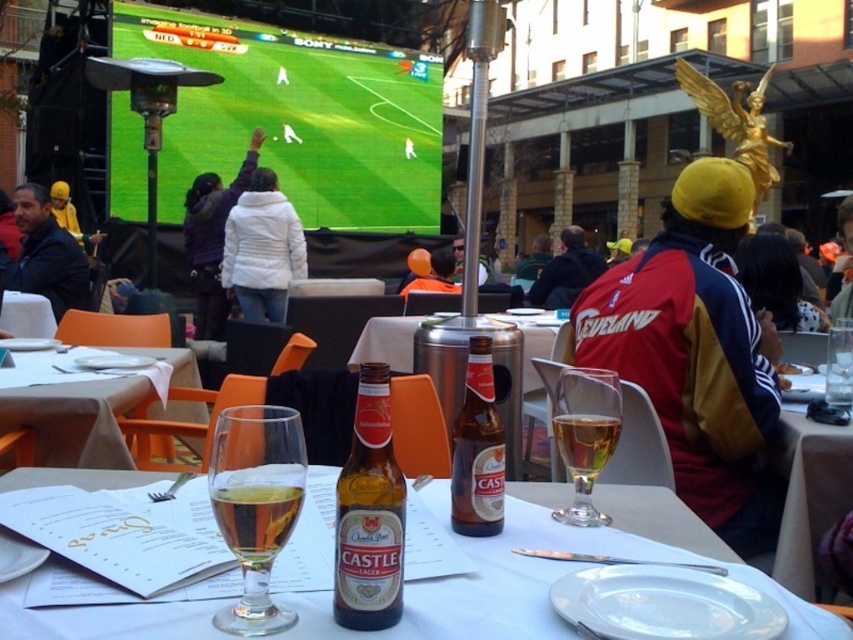
Question: Is white fabric table at lower left positioned behind clear glass beer at center?

Choices:
 (A) yes
 (B) no

Answer: (A)

Question: Considering the real-world distances, which object is farthest from the red and blue jacket at center?

Choices:
 (A) translucent glass at table center
 (B) dark blue jacket at center
 (C) orange fabric at center

Answer: (B)

Question: In this image, where is clear glass wine glass at center located relative to white matte jacket at upper center?

Choices:
 (A) left
 (B) right

Answer: (B)

Question: Which object is closer to the camera taking this photo?

Choices:
 (A) white paper napkin at upper left
 (B) amber glass castle lager at center
 (C) white puffy jacket at upper center
 (D) clear glass wine glass at center

Answer: (D)

Question: Which of the following is the farthest from the observer?

Choices:
 (A) (741, 385)
 (B) (373, 353)
 (C) (576, 429)

Answer: (B)

Question: Is white puffy jacket at upper center closer to the viewer compared to orange fabric at center?

Choices:
 (A) no
 (B) yes

Answer: (B)